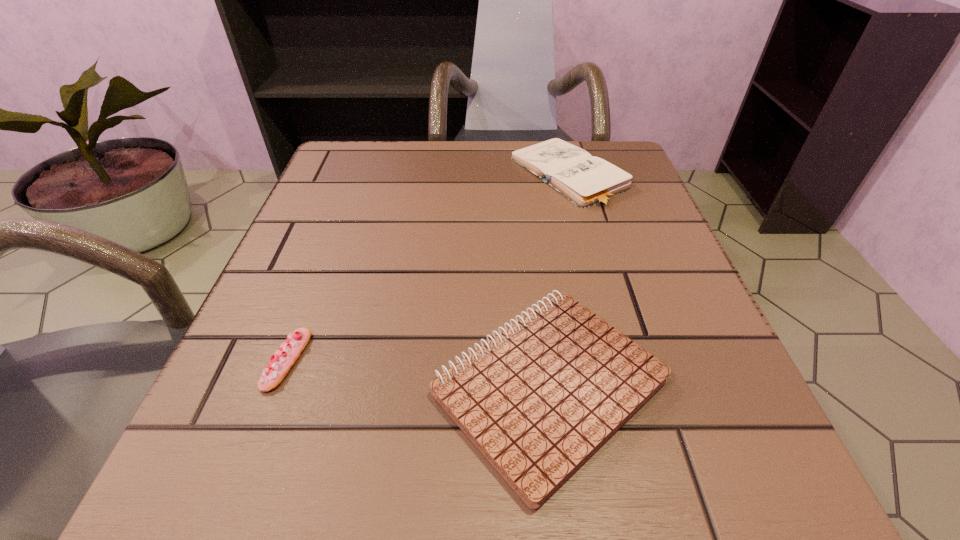
This screenshot has width=960, height=540. I want to click on object that is at the near right corner, so click(538, 400).

Where is `vacant space at the far edge`? vacant space at the far edge is located at coordinates (476, 152).

In order to click on vacant space at the near edge of the desktop in this screenshot , I will do `click(557, 498)`.

In the image, there is a desktop. Identify the location of free region at the left edge. This screenshot has height=540, width=960. (307, 214).

The image size is (960, 540). What are the coordinates of `vacant space at the right edge of the desktop` in the screenshot? It's located at (724, 401).

This screenshot has width=960, height=540. I want to click on vacant space at the far left corner, so click(x=402, y=144).

This screenshot has width=960, height=540. Identify the location of blank space at the far right corner of the desktop. (615, 154).

This screenshot has width=960, height=540. In the image, there is a desktop. What are the coordinates of `vacant space at the near right corner` in the screenshot? It's located at (749, 485).

Find the location of a particular element. vacant area between the leftmost object and the farthest object is located at coordinates (428, 268).

Locate an element on the screen. The image size is (960, 540). unoccupied position between the nearer notebook and the farther notebook is located at coordinates (559, 280).